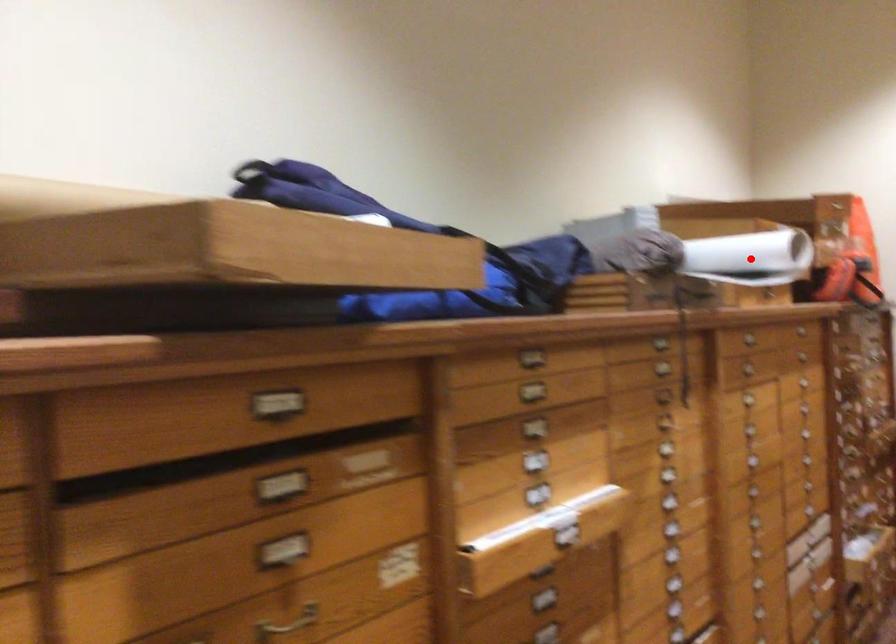
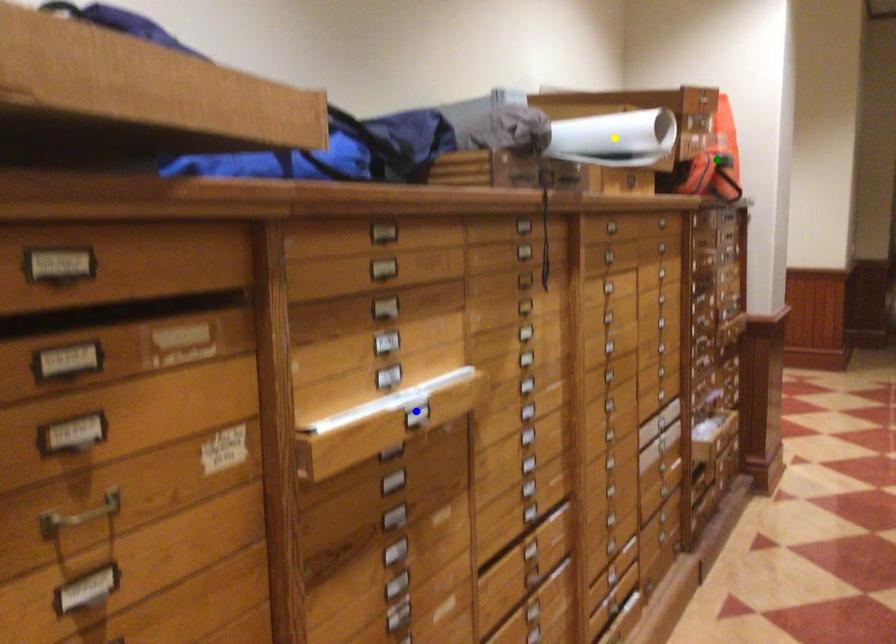
Question: I am providing you with two images of the same scene from different viewpoints. A red point is marked on the first image. You are given multiple points on the second image. Which spot in image 2 lines up with the point in image 1?

Choices:
 (A) yellow point
 (B) blue point
 (C) green point

Answer: (A)